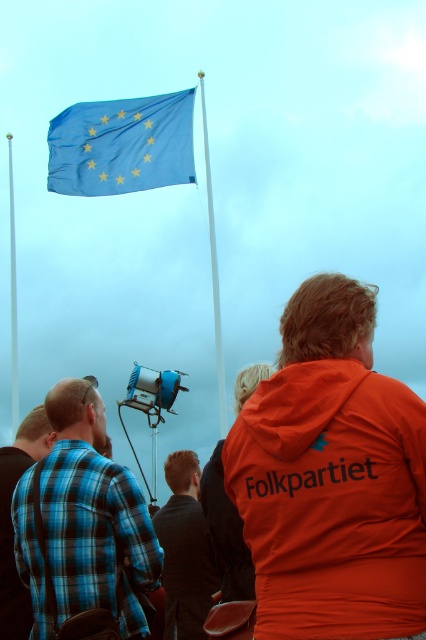
Is blue fabric flag at upper center to the right of white plastic flag pole at upper center from the viewer's perspective?

Yes, blue fabric flag at upper center is to the right of white plastic flag pole at upper center.

Between blue fabric flag at upper center and white plastic flag pole at upper center, which one is positioned lower?

white plastic flag pole at upper center

Is point (103, 128) positioned after point (11, 388)?

No, it is in front of (11, 388).

Identify the location of blue fabric flag at upper center. The width and height of the screenshot is (426, 640). (121, 145).

Which is behind, point (264, 465) or point (210, 598)?

The point (210, 598) is behind.

Looking at this image, does orange fabric jacket at center come behind dark brown leather jacket at center?

No, it is in front of dark brown leather jacket at center.

Measure the distance between orange fabric jacket at center and camera.

A distance of 17.95 meters exists between orange fabric jacket at center and camera.

I want to click on orange fabric jacket at center, so click(x=331, y=477).

Is the position of blue fabric flag at upper center less distant than that of dark brown leather jacket at center?

No, blue fabric flag at upper center is behind dark brown leather jacket at center.

Describe the element at coordinates (121, 145) in the screenshot. I see `blue fabric flag at upper center` at that location.

The image size is (426, 640). Identify the location of blue fabric flag at upper center. (121, 145).